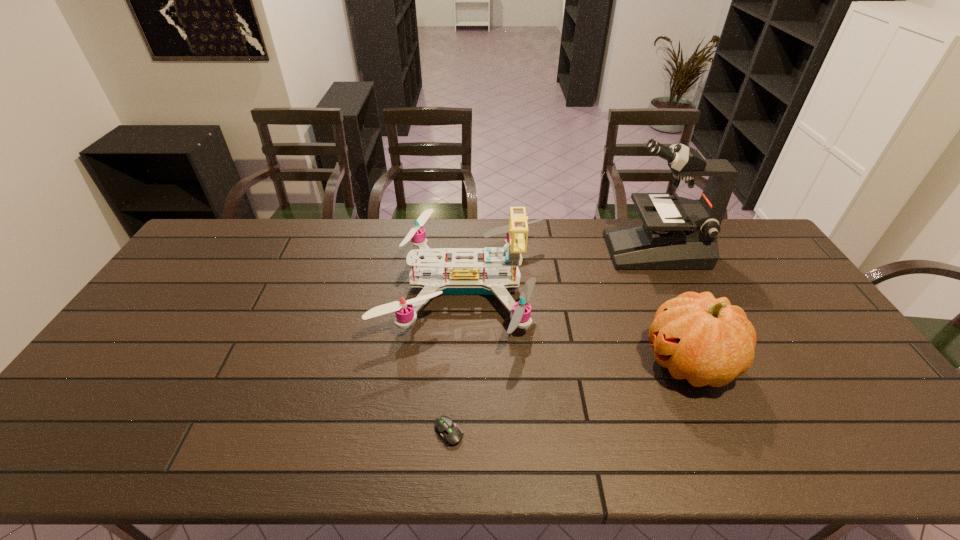
Locate an element on the screen. This screenshot has height=540, width=960. the tallest object is located at coordinates (682, 234).

Locate an element on the screen. Image resolution: width=960 pixels, height=540 pixels. drone is located at coordinates (464, 276).

This screenshot has height=540, width=960. I want to click on pumpkin, so click(708, 341).

At what (x,y) coordinates should I click in order to perform the action: click on the nearest object. Please return your answer as a coordinate pair (x, y). Looking at the image, I should click on (449, 432).

Find the location of a particular element. The width and height of the screenshot is (960, 540). computer mouse is located at coordinates (449, 432).

Find the location of `vacant space located through the eyepieces of the microscope`. vacant space located through the eyepieces of the microscope is located at coordinates click(x=554, y=251).

The height and width of the screenshot is (540, 960). I want to click on vacant area situated 0.130m through the eyepieces of the microscope, so click(x=571, y=251).

At what (x,y) coordinates should I click in order to perform the action: click on vacant space located 0.080m through the eyepieces of the microscope. Please return your answer as a coordinate pair (x, y). The height and width of the screenshot is (540, 960). Looking at the image, I should click on coord(586,251).

Identify the location of vacant region located on the front-facing side of the drone. This screenshot has width=960, height=540. (592, 287).

The image size is (960, 540). In order to click on vacant area situated on the carved face of the pumpkin in this screenshot , I will do `click(506, 363)`.